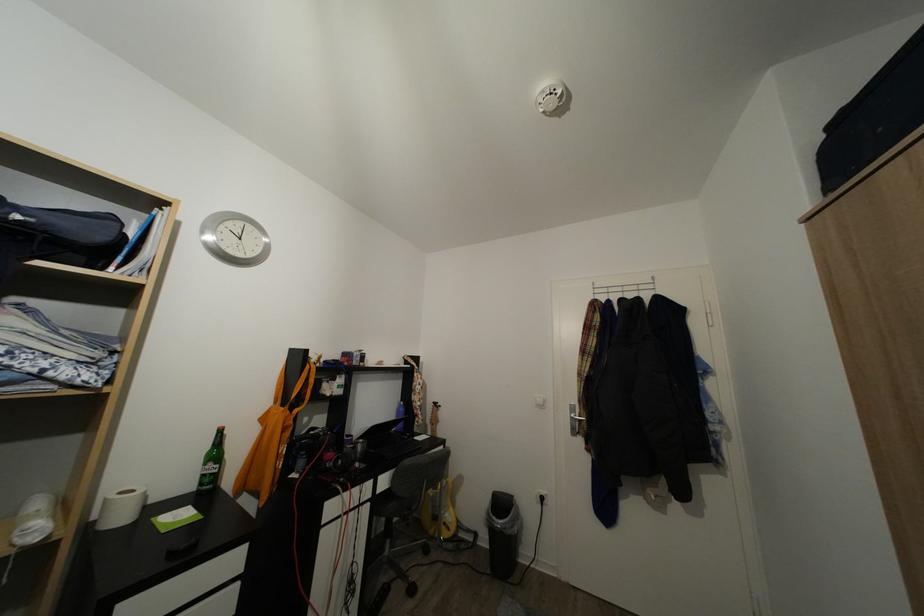
Which object does [62,233] point to?

It refers to a black suitcase.